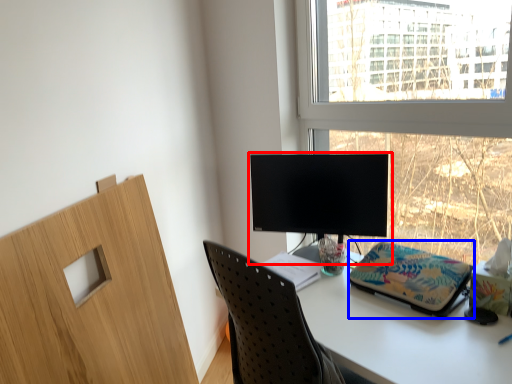
Question: Among these objects, which one is nearest to the camera, computer monitor (highlighted by a red box) or stationery (highlighted by a blue box)?

Choices:
 (A) computer monitor
 (B) stationery

Answer: (B)